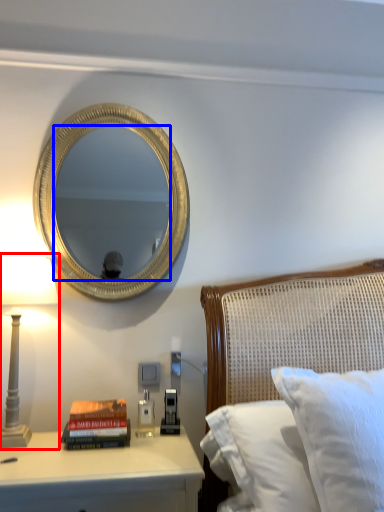
Question: Among these objects, which one is farthest to the camera, bedside lamp (highlighted by a red box) or mirror (highlighted by a blue box)?

Choices:
 (A) bedside lamp
 (B) mirror

Answer: (B)